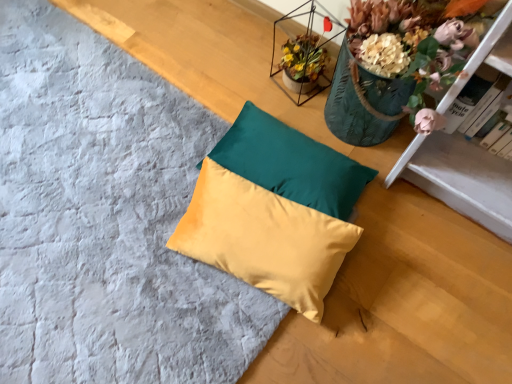
Question: Visually, is hardcover book at upper right positioned to the left or to the right of satin yellow pillow at center, placed as the first pillow when sorted from top to bottom?

Choices:
 (A) right
 (B) left

Answer: (A)

Question: Does point (475, 79) appear closer or farther from the camera than point (280, 125)?

Choices:
 (A) farther
 (B) closer

Answer: (B)

Question: Estimate the real-world distances between objects in this image. Which object is farther from the satin yellow pillow at center, marked as the second pillow in a bottom-to-top arrangement?

Choices:
 (A) satin yellow pillow at center, acting as the first pillow starting from the bottom
 (B) hardcover book at upper right

Answer: (B)

Question: Based on their relative distances, which object is farther from the satin yellow pillow at center, acting as the first pillow starting from the bottom?

Choices:
 (A) hardcover book at upper right
 (B) satin yellow pillow at center, placed as the first pillow when sorted from top to bottom

Answer: (A)